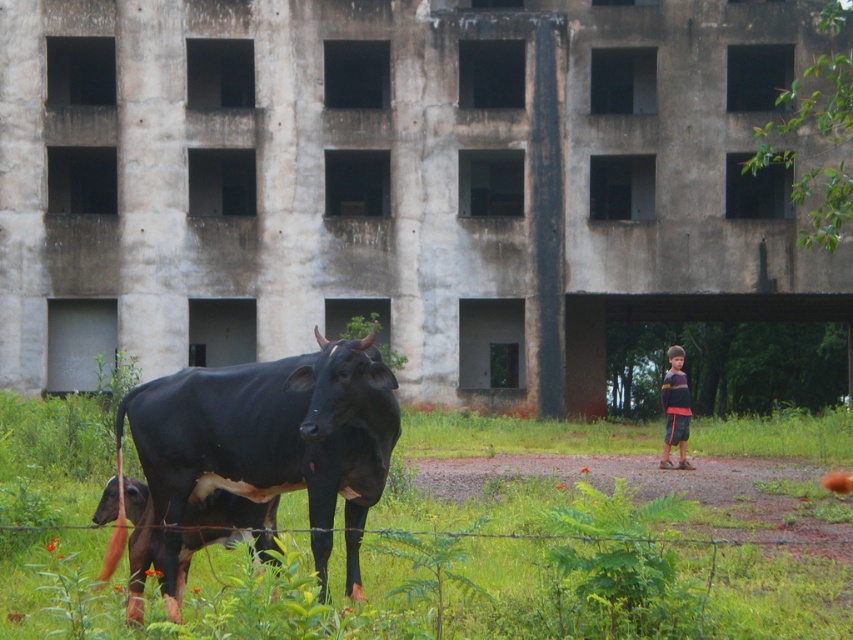
Identify the location of black glossy bull at center. This screenshot has width=853, height=640. (271, 436).

You are a GUI agent. You are given a task and a screenshot of the screen. Output one action in this format:
    pyautogui.click(x=<x>, y=<y>)
    Task: Click on the black glossy bull at center
    
    Given the screenshot: What is the action you would take?
    pyautogui.click(x=271, y=436)

Who is positioned more to the left, green grass at lower left or black glossy bull at center?

Positioned to the left is black glossy bull at center.

Which of these two, green grass at lower left or black glossy bull at center, stands taller?

Standing taller between the two is black glossy bull at center.

Between point (820, 524) and point (314, 444), which one is positioned in front?

Point (314, 444) is more forward.

Identify the location of green grass at lower left. (486, 568).

Who is higher up, green grass at lower left or striped long-sleeve shirt at right?

striped long-sleeve shirt at right is higher up.

Who is positioned more to the right, green grass at lower left or striped long-sleeve shirt at right?

striped long-sleeve shirt at right is more to the right.

Locate an element on the screen. This screenshot has height=640, width=853. green grass at lower left is located at coordinates tap(486, 568).